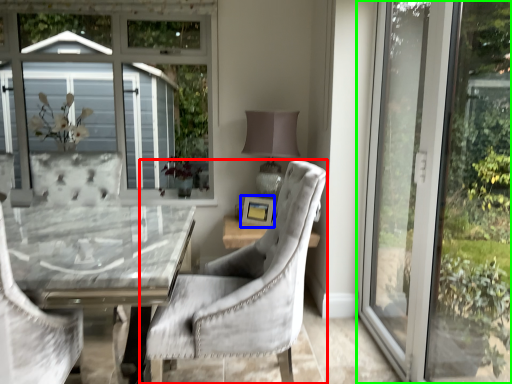
Question: Which object is the closest to the chair (highlighted by a red box)? Choose among these: picture frame (highlighted by a blue box) or window (highlighted by a green box).

Choices:
 (A) picture frame
 (B) window

Answer: (B)